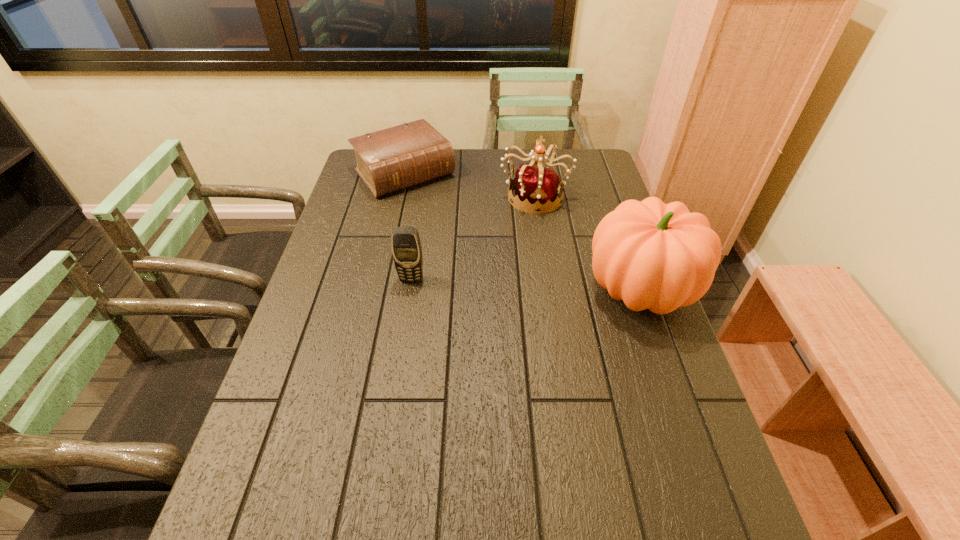
This screenshot has width=960, height=540. In order to click on vacant spot on the desktop that is between the cellular telephone and the pumpkin and is positioned on the front-facing side of the third shortest object in this screenshot , I will do click(540, 285).

The height and width of the screenshot is (540, 960). I want to click on free spot on the desktop that is between the second shortest object and the pumpkin and is positioned on the spine side of the shortest object, so click(x=499, y=283).